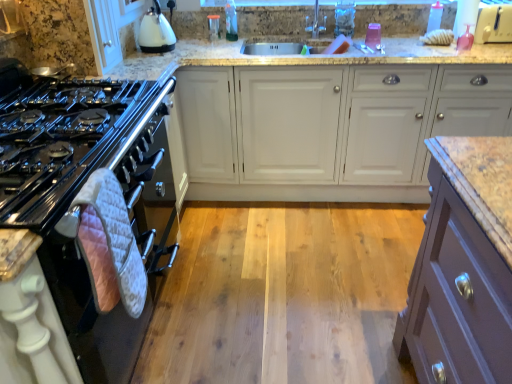
At what (x,y) coordinates should I click in order to perform the action: click on vacant space situated on the left part of transparent plastic bottle at upper right, the second bottle in the left-to-right sequence. Please return your answer as a coordinate pair (x, y). Image resolution: width=512 pixels, height=384 pixels. Looking at the image, I should click on (412, 34).